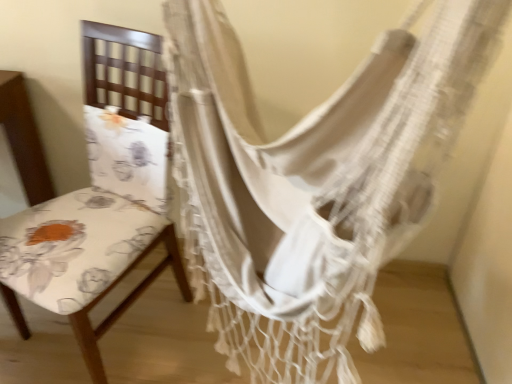
Question: Looking at the image, does white woven hammock at center seem bigger or smaller compared to floral fabric chair at left?

Choices:
 (A) big
 (B) small

Answer: (A)

Question: From the image's perspective, is white woven hammock at center above or below floral fabric chair at left?

Choices:
 (A) above
 (B) below

Answer: (A)

Question: Is white woven hammock at center to the left or to the right of floral fabric chair at left in the image?

Choices:
 (A) right
 (B) left

Answer: (A)

Question: Is floral fabric chair at left wider or thinner than white woven hammock at center?

Choices:
 (A) thin
 (B) wide

Answer: (B)

Question: From the image's perspective, is floral fabric chair at left positioned above or below white woven hammock at center?

Choices:
 (A) above
 (B) below

Answer: (B)

Question: In terms of height, does floral fabric chair at left look taller or shorter compared to white woven hammock at center?

Choices:
 (A) short
 (B) tall

Answer: (B)

Question: Does point (84, 354) appear closer or farther from the camera than point (367, 144)?

Choices:
 (A) closer
 (B) farther

Answer: (B)